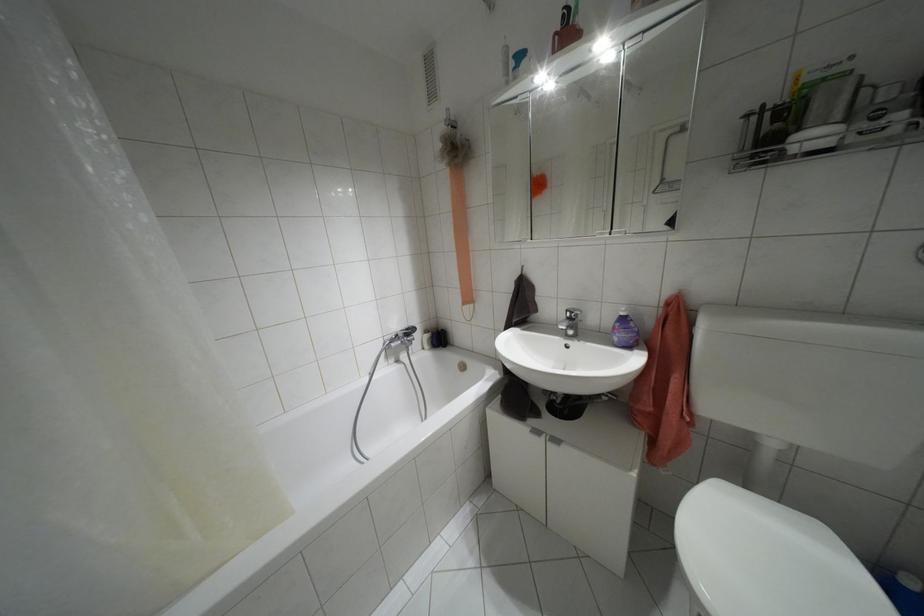
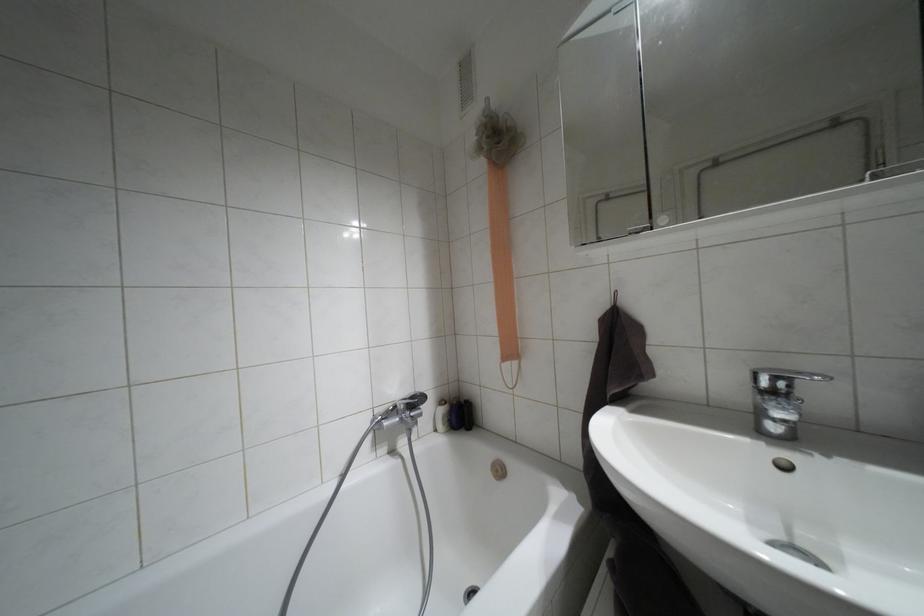
Question: What movement of the cameraman would produce the second image?

Choices:
 (A) Left
 (B) Right
 (C) Forward
 (D) Backward

Answer: (C)